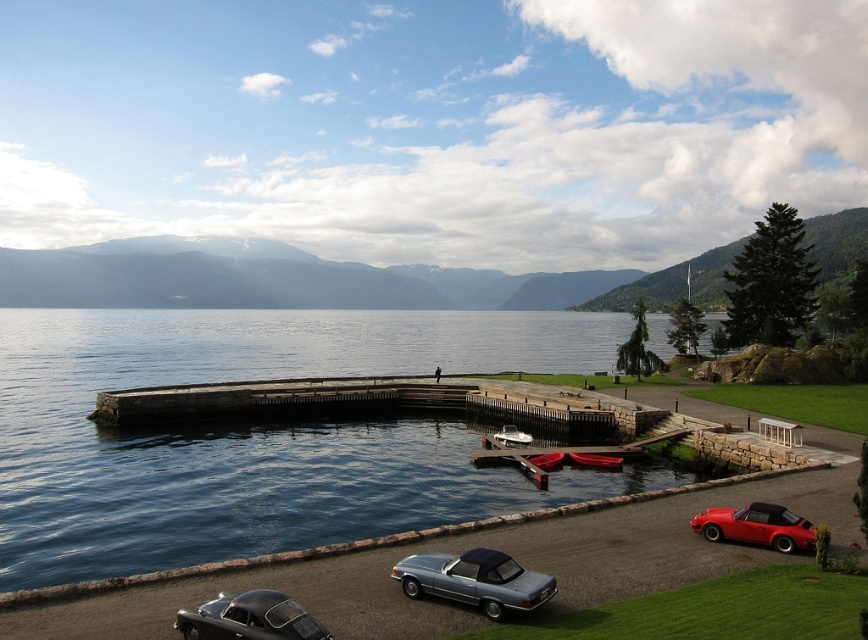
You are standing at the point with coordinates point (474,580). Which object are you on?

You are on the metallic silver convertible at lower center.

You are standing at the lakeside and want to walk towards the dock. There are two objects in your path. Which one is closer to you? The blue water at center or the metallic silver convertible at lower center?

The metallic silver convertible at lower center is closer to you because the blue water at center is further away.

You are a photographer planning to capture the white glossy boat at center and the blue water at center in a single shot. Based on their positions, which object should you focus on first to ensure both are in the frame?

The blue water at center is located above the white glossy boat at center, so you should focus on the white glossy boat at center first to ensure both are captured in the frame.